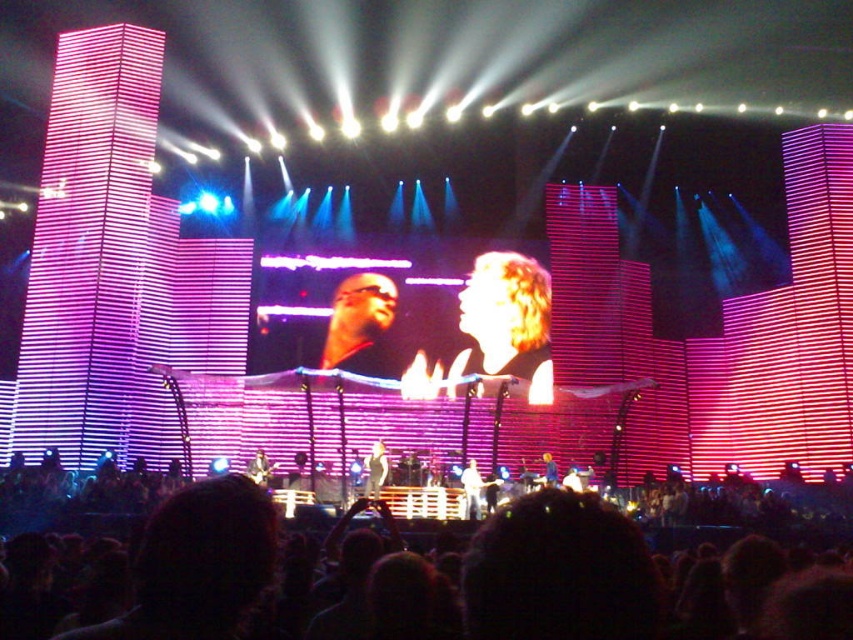
You are a photographer at the concert and want to capture a closeup shot of the matte black glasses at center and the white glossy microphone at center. Which object should you zoom in on more to ensure both are in focus?

The matte black glasses at center is larger in size than the white glossy microphone at center, so you should zoom in more on the matte black glasses at center to ensure both are in focus.